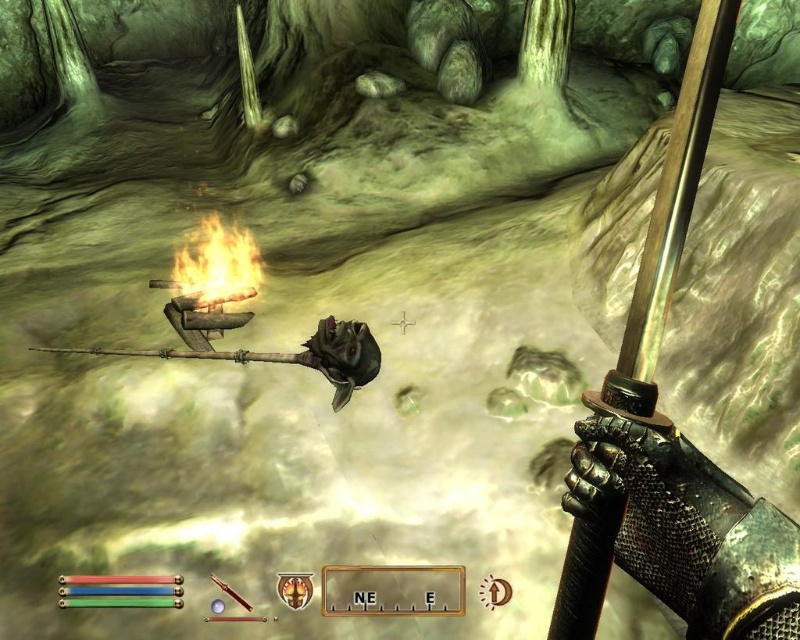
You are a knight in a dark cave holding a polished steel sword at right and seeing a flaming wood at center. Which object is closer to your right hand?

The polished steel sword at right is closer to your right hand because it is positioned on the right side of the flaming wood at center.